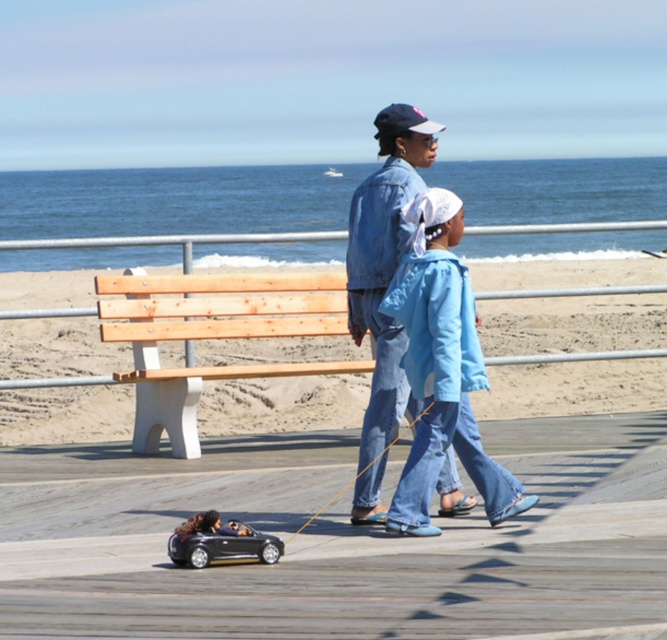
Which is above, blue denim jacket at center or shiny metallic toy car at lower center?

blue denim jacket at center is above.

Can you confirm if blue denim jacket at center is bigger than shiny metallic toy car at lower center?

A: Correct, blue denim jacket at center is larger in size than shiny metallic toy car at lower center.

Locate an element on the screen. This screenshot has height=640, width=667. blue denim jacket at center is located at coordinates (432, 348).

Identify the location of blue denim jacket at center. This screenshot has width=667, height=640. (432, 348).

Is natural wood bench at center shorter than dark blue fabric baseball cap at upper center?

Incorrect, natural wood bench at center's height does not fall short of dark blue fabric baseball cap at upper center's.

Is natural wood bench at center further to camera compared to dark blue fabric baseball cap at upper center?

Yes, natural wood bench at center is further from the viewer.

Who is more distant from viewer, (616, 301) or (398, 120)?

Positioned behind is point (616, 301).

Identify the location of natural wood bench at center. click(x=572, y=323).

How distant is natural wood bench at center from shiny metallic toy car at lower center?

natural wood bench at center is 8.39 meters from shiny metallic toy car at lower center.

Which is below, natural wood bench at center or shiny metallic toy car at lower center?

shiny metallic toy car at lower center is below.

Is point (3, 292) behind point (259, 532)?

Yes, it is.

Where is `natural wood bench at center`? The width and height of the screenshot is (667, 640). natural wood bench at center is located at coordinates (572, 323).